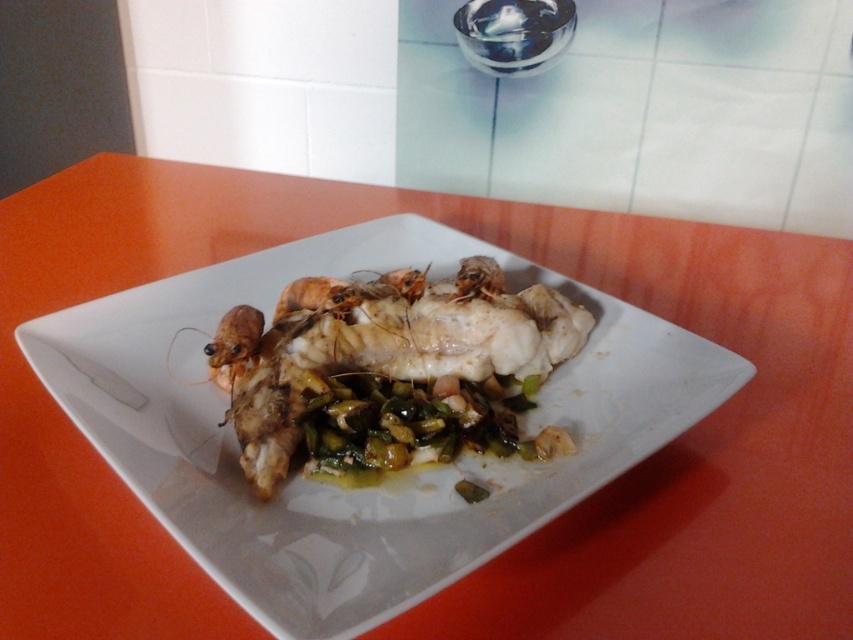
The image size is (853, 640). Describe the element at coordinates (387, 369) in the screenshot. I see `white glossy fish at center` at that location.

This screenshot has width=853, height=640. Describe the element at coordinates (387, 369) in the screenshot. I see `white glossy fish at center` at that location.

Where is `white glossy fish at center`? The width and height of the screenshot is (853, 640). white glossy fish at center is located at coordinates (387, 369).